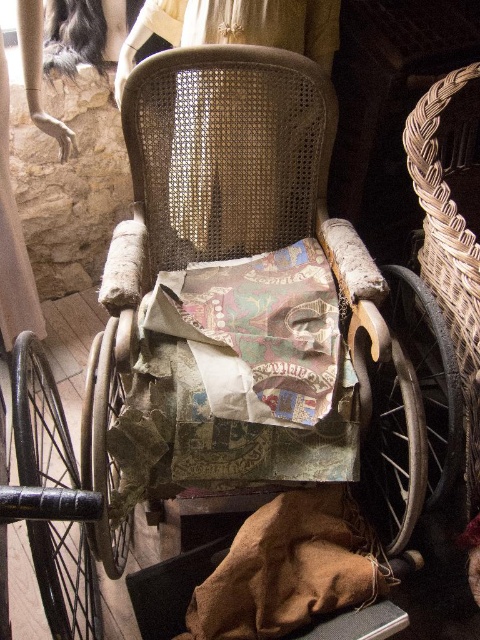
Question: Which object appears closest to the camera in this image?

Choices:
 (A) worn wood chair at center
 (B) woven brown basket at right

Answer: (A)

Question: Can you confirm if worn wood chair at center is thinner than woven brown basket at right?

Choices:
 (A) no
 (B) yes

Answer: (A)

Question: Is worn wood chair at center to the left of woven brown basket at right from the viewer's perspective?

Choices:
 (A) no
 (B) yes

Answer: (B)

Question: Does worn wood chair at center appear on the left side of woven brown basket at right?

Choices:
 (A) no
 (B) yes

Answer: (B)